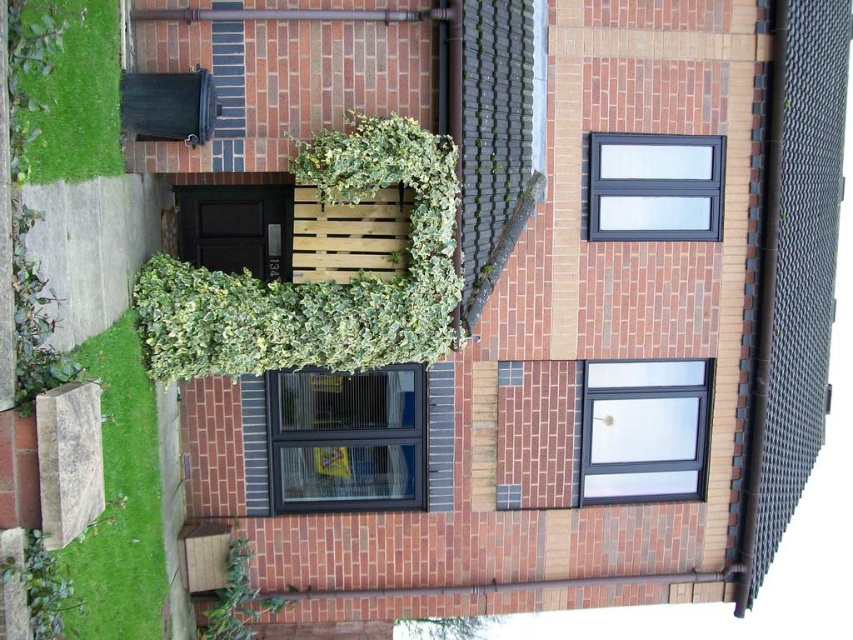
Who is positioned more to the left, green leafy grass at lower left or green leafy plant at lower center?

green leafy grass at lower left is more to the left.

What do you see at coordinates (68, 90) in the screenshot? I see `green leafy grass at lower left` at bounding box center [68, 90].

Describe the element at coordinates (68, 90) in the screenshot. I see `green leafy grass at lower left` at that location.

You are a GUI agent. You are given a task and a screenshot of the screen. Output one action in this format:
    pyautogui.click(x=<x>, y=<y>)
    Task: Click on the green leafy grass at lower left
    Image resolution: width=853 pixels, height=640 pixels.
    Given the screenshot: What is the action you would take?
    pyautogui.click(x=68, y=90)

Which of these two, green leafy plant at center or green leafy plant at lower center, stands shorter?

With less height is green leafy plant at lower center.

Does green leafy plant at center appear on the right side of green leafy plant at lower center?

Indeed, green leafy plant at center is positioned on the right side of green leafy plant at lower center.

Who is more forward, (440, 340) or (213, 616)?

Point (440, 340) is more forward.

Identify the location of green leafy plant at center. The height and width of the screenshot is (640, 853). (321, 280).

Is green leafy grass at lower left further to camera compared to green leafy plant at lower left?

Yes, it is.

Does point (39, 157) come behind point (22, 637)?

Yes, it is.

Find the location of a particular element. The width and height of the screenshot is (853, 640). green leafy grass at lower left is located at coordinates (68, 90).